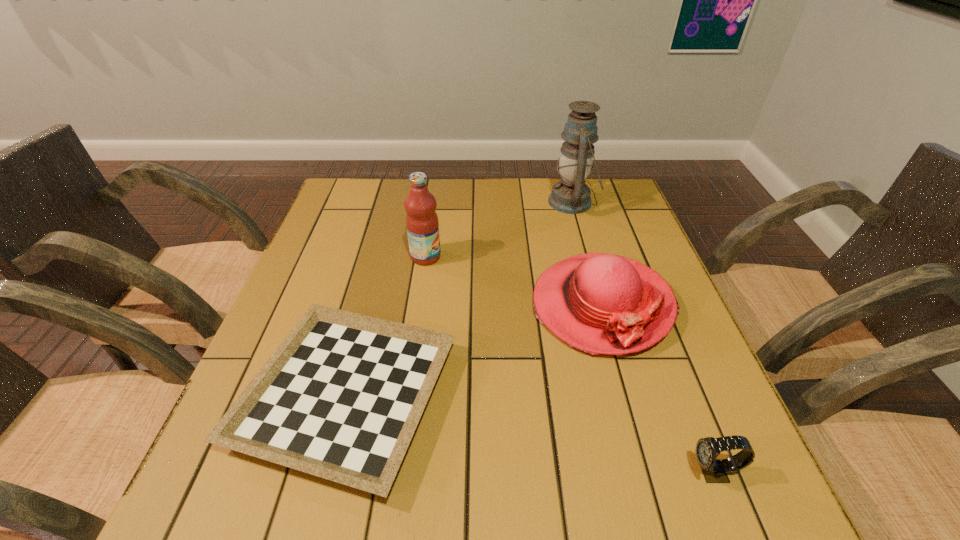
Identify the location of object that is at the near left corner. (340, 398).

The height and width of the screenshot is (540, 960). What are the coordinates of `object at the far right corner` in the screenshot? It's located at (571, 195).

Identify the location of object at the near right corner. Image resolution: width=960 pixels, height=540 pixels. (714, 470).

In the image, there is a desktop. At what (x,y) coordinates should I click in order to perform the action: click on vacant space at the far edge. Please return your answer as a coordinate pair (x, y). This screenshot has height=540, width=960. Looking at the image, I should click on (436, 181).

Find the location of `vacant space at the near edge of the desktop`. vacant space at the near edge of the desktop is located at coordinates (606, 497).

I want to click on vacant space at the left edge of the desktop, so (x=306, y=258).

At what (x,y) coordinates should I click in order to perform the action: click on vacant space at the right edge. Please return your answer as a coordinate pair (x, y). The height and width of the screenshot is (540, 960). Looking at the image, I should click on (679, 320).

This screenshot has width=960, height=540. Find the location of `vacant space at the far left corner`. vacant space at the far left corner is located at coordinates (372, 200).

Locate an element on the screen. The width and height of the screenshot is (960, 540). free space between the watch and the second tallest object is located at coordinates (569, 364).

Find the location of a particular element. This screenshot has height=540, width=960. free spot between the fourth shortest object and the oil lamp is located at coordinates (499, 230).